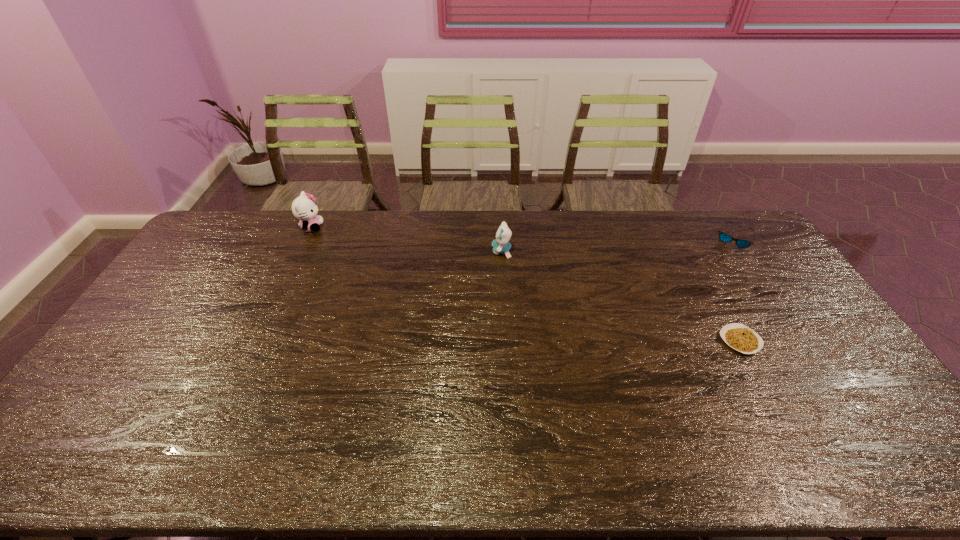
Identify the location of vacant space that's between the farther kitten and the third object from left to right. This screenshot has width=960, height=540. (526, 284).

The height and width of the screenshot is (540, 960). In order to click on empty space that is in between the rightmost object and the shorter kitten in this screenshot , I will do `click(617, 245)`.

Where is `object that ranks as the third closest to the legume`? The height and width of the screenshot is (540, 960). object that ranks as the third closest to the legume is located at coordinates (304, 208).

Point out which object is positioned as the nearest to the third tallest object. Please provide its 2D coordinates. Your answer should be formatted as a tuple, i.e. [(x, y)], where the tuple contains the x and y coordinates of a point satisfying the conditions above.

[(740, 337)]

The image size is (960, 540). Find the location of `vacant area that satisfies the following two spatial constraints: 1. on the face of the shorter kitten; 2. on the back side of the nearest object`. vacant area that satisfies the following two spatial constraints: 1. on the face of the shorter kitten; 2. on the back side of the nearest object is located at coordinates (507, 341).

Image resolution: width=960 pixels, height=540 pixels. In order to click on vacant space that satisfies the following two spatial constraints: 1. on the face of the second object from left to right; 2. on the right side of the shortest object in this screenshot , I will do [x=507, y=341].

I want to click on free space that satisfies the following two spatial constraints: 1. at the front of the rightmost object showing the lenses; 2. on the face of the third shortest object, so click(x=742, y=251).

Where is `free point that satisfies the following two spatial constraints: 1. at the front of the sunglasses showing the lenses; 2. on the face of the shorter kitten`? The height and width of the screenshot is (540, 960). free point that satisfies the following two spatial constraints: 1. at the front of the sunglasses showing the lenses; 2. on the face of the shorter kitten is located at coordinates (742, 251).

Locate an element on the screen. The height and width of the screenshot is (540, 960). vacant position in the image that satisfies the following two spatial constraints: 1. on the front-facing side of the farther kitten; 2. on the left side of the legume is located at coordinates (258, 341).